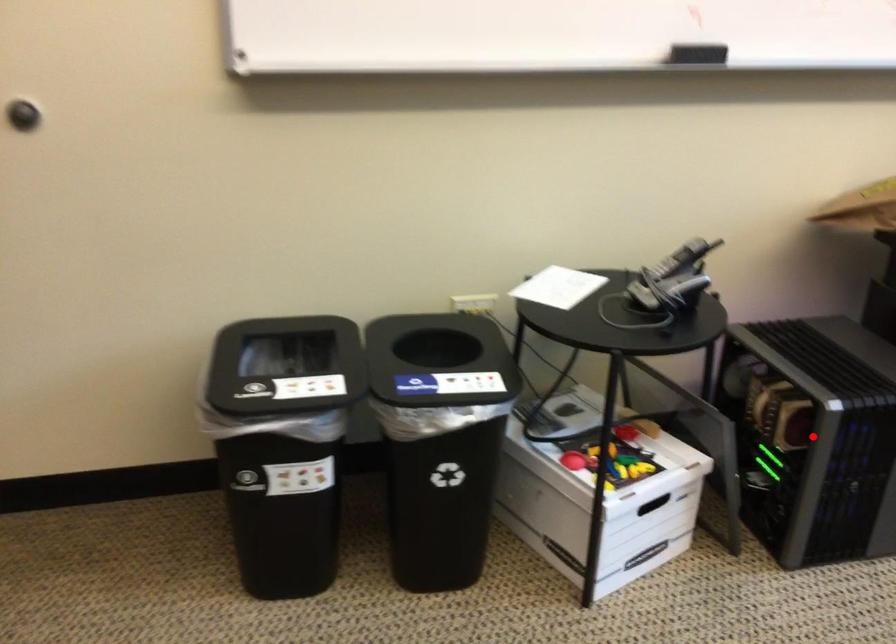
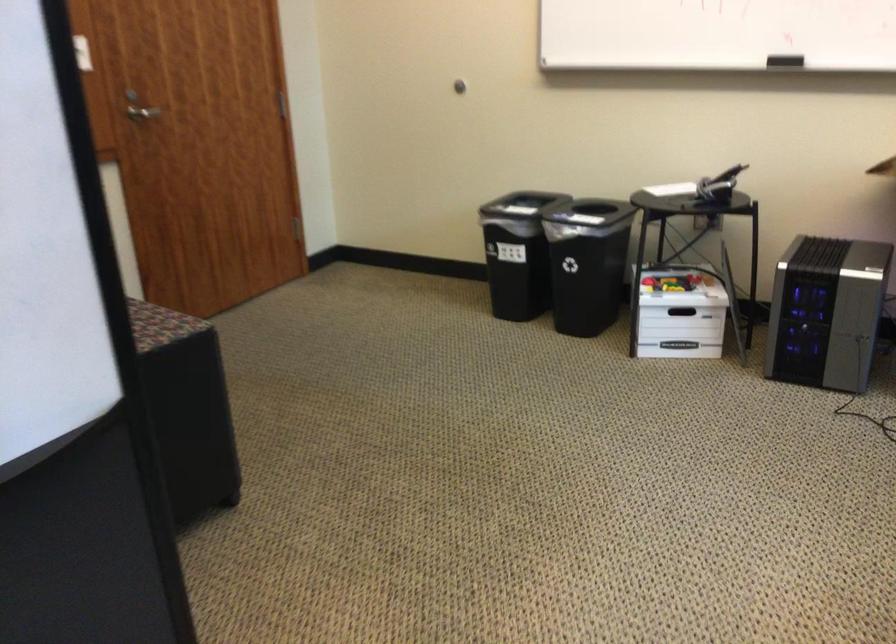
Question: I am providing you with two images of the same scene from different viewpoints. A red point is marked on the first image. Can you still see the location of the red point in image 2?

Choices:
 (A) Yes
 (B) No

Answer: (B)